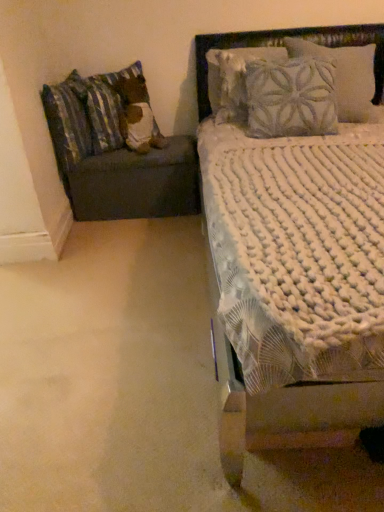
Question: Is the depth of dark gray fabric ottoman at left greater than that of fluffy fabric headboard at upper right?

Choices:
 (A) no
 (B) yes

Answer: (B)

Question: From a real-world perspective, is dark gray fabric ottoman at left on top of fluffy fabric headboard at upper right?

Choices:
 (A) yes
 (B) no

Answer: (B)

Question: Is dark gray fabric ottoman at left turned away from fluffy fabric headboard at upper right?

Choices:
 (A) no
 (B) yes

Answer: (A)

Question: Considering the relative sizes of dark gray fabric ottoman at left and fluffy fabric headboard at upper right in the image provided, is dark gray fabric ottoman at left thinner than fluffy fabric headboard at upper right?

Choices:
 (A) no
 (B) yes

Answer: (A)

Question: Is dark gray fabric ottoman at left bigger than fluffy fabric headboard at upper right?

Choices:
 (A) no
 (B) yes

Answer: (B)

Question: From a real-world perspective, is dark gray fabric ottoman at left positioned above or below white textured bed at upper right?

Choices:
 (A) above
 (B) below

Answer: (B)

Question: Do you think dark gray fabric ottoman at left is within white textured bed at upper right, or outside of it?

Choices:
 (A) inside
 (B) outside

Answer: (B)

Question: Visually, is dark gray fabric ottoman at left positioned to the left or to the right of white textured bed at upper right?

Choices:
 (A) left
 (B) right

Answer: (A)

Question: From the image's perspective, relative to white textured bed at upper right, is dark gray fabric ottoman at left above or below?

Choices:
 (A) below
 (B) above

Answer: (B)

Question: Considering the positions of fluffy fabric pillow at left, the 1th pillow positioned from the right, and striped fabric pillow at left, the 1th pillow positioned from the left, in the image, is fluffy fabric pillow at left, the 1th pillow positioned from the right, bigger or smaller than striped fabric pillow at left, the 1th pillow positioned from the left,?

Choices:
 (A) big
 (B) small

Answer: (B)

Question: Is fluffy fabric pillow at left, which is counted as the second pillow, starting from the left, wider or thinner than striped fabric pillow at left, the 1th pillow positioned from the left?

Choices:
 (A) wide
 (B) thin

Answer: (A)

Question: From a real-world perspective, relative to striped fabric pillow at left, the 1th pillow positioned from the left, is fluffy fabric pillow at left, the 1th pillow positioned from the right, vertically above or below?

Choices:
 (A) below
 (B) above

Answer: (B)

Question: Relative to striped fabric pillow at left, placed as the 2th pillow when sorted from right to left, is fluffy fabric pillow at left, which is counted as the second pillow, starting from the left, in front or behind?

Choices:
 (A) behind
 (B) front

Answer: (A)

Question: Looking at the image, does striped fabric pillow at left, placed as the 2th pillow when sorted from right to left, seem bigger or smaller compared to white textured bed at upper right?

Choices:
 (A) small
 (B) big

Answer: (A)

Question: Is point (57, 108) closer or farther from the camera than point (208, 111)?

Choices:
 (A) closer
 (B) farther

Answer: (A)